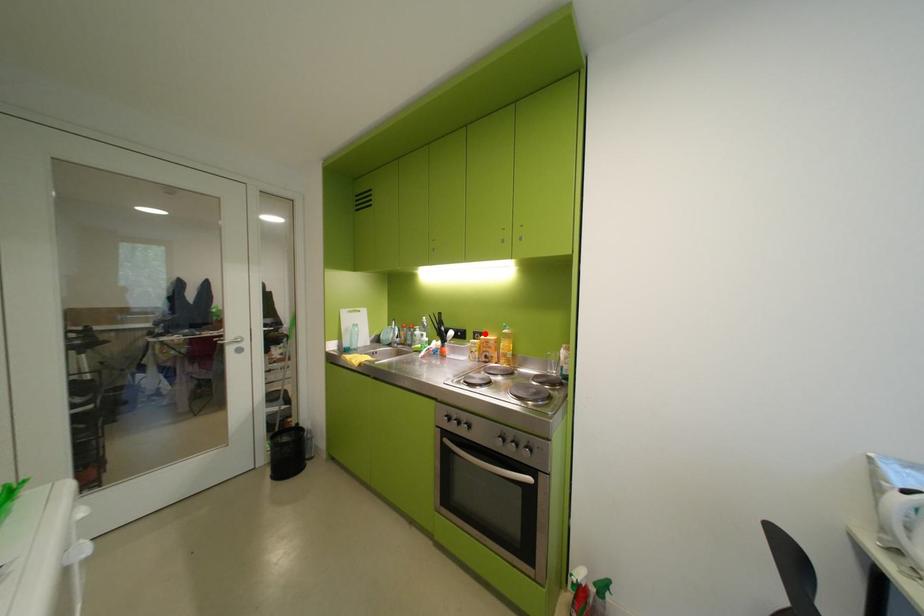
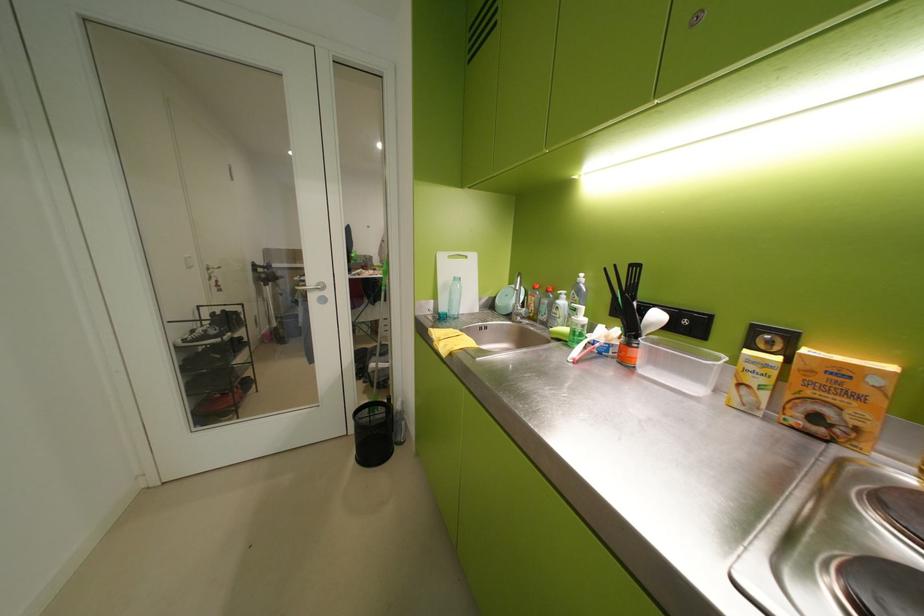
The point at the highlighted location is marked in the first image. Where is the corresponding point in the second image?

(767, 331)